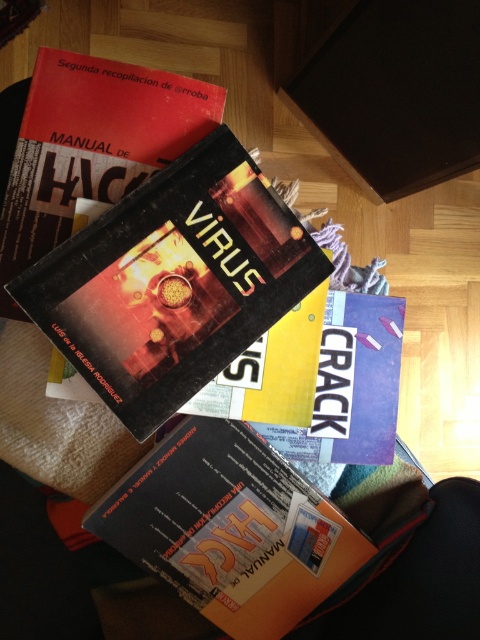
Question: Which object is farther from the camera taking this photo?

Choices:
 (A) shiny metallic book at center
 (B) orange matte manual at center
 (C) metallic blue book at center

Answer: (C)

Question: Is matte black book at upper left bigger than metallic blue book at center?

Choices:
 (A) yes
 (B) no

Answer: (A)

Question: Is orange matte manual at center bigger than matte black book at upper left?

Choices:
 (A) no
 (B) yes

Answer: (A)

Question: In this image, where is orange matte manual at center located relative to matte black book at upper left?

Choices:
 (A) above
 (B) below

Answer: (B)

Question: Which object is the farthest from the metallic blue book at center?

Choices:
 (A) orange matte manual at center
 (B) shiny metallic book at center

Answer: (B)

Question: Which object appears farthest from the camera in this image?

Choices:
 (A) shiny metallic book at center
 (B) matte black book at upper left
 (C) metallic blue book at center

Answer: (C)